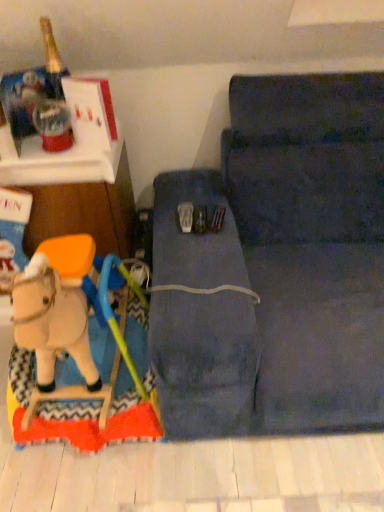
In order to face dark blue fabric studio couch at center, should I rotate leftwards or rightwards?

A 14.778 degree turn to the right will do.

At what (x,y) coordinates should I click in order to perform the action: click on dark blue fabric studio couch at center. Please return your answer as a coordinate pair (x, y). Looking at the image, I should click on (278, 267).

How many degrees apart are the facing directions of wooden rocking horse at left and wooden matte horse at lower left?

There is a 0.332-degree angle between the facing directions of wooden rocking horse at left and wooden matte horse at lower left.

Is wooden rocking horse at left further to the viewer compared to wooden matte horse at lower left?

Yes.

From the image's perspective, would you say wooden rocking horse at left is shown under wooden matte horse at lower left?

No, from the image's perspective, wooden rocking horse at left is not below wooden matte horse at lower left.

Would you say wooden rocking horse at left is outside wooden matte horse at lower left?

Yes, wooden rocking horse at left is not within wooden matte horse at lower left.

Considering the positions of objects wooden matte horse at lower left and dark blue fabric studio couch at center in the image provided, who is behind, wooden matte horse at lower left or dark blue fabric studio couch at center?

wooden matte horse at lower left.

Is wooden matte horse at lower left in contact with dark blue fabric studio couch at center?

No, wooden matte horse at lower left is not next to dark blue fabric studio couch at center.

Locate an element on the screen. This screenshot has height=512, width=384. furniture above the dark blue fabric studio couch at center (from the image's perspective) is located at coordinates (79, 199).

Is wooden rocking horse at left positioned with its back to dark blue fabric studio couch at center?

No, wooden rocking horse at left is not facing the opposite direction of dark blue fabric studio couch at center.

Is wooden rocking horse at left taller or shorter than dark blue fabric studio couch at center?

In the image, wooden rocking horse at left appears to be taller than dark blue fabric studio couch at center.

Is wooden rocking horse at left completely or partially outside of dark blue fabric studio couch at center?

Absolutely, wooden rocking horse at left is external to dark blue fabric studio couch at center.

Considering the relative sizes of wooden matte horse at lower left and wooden rocking horse at left in the image provided, is wooden matte horse at lower left bigger than wooden rocking horse at left?

No, wooden matte horse at lower left is not bigger than wooden rocking horse at left.

Would you say wooden matte horse at lower left is outside wooden rocking horse at left?

wooden matte horse at lower left lies outside wooden rocking horse at left's area.

Which object is further away from the camera, wooden matte horse at lower left or wooden rocking horse at left?

wooden rocking horse at left is further away from the camera.

Image resolution: width=384 pixels, height=512 pixels. What are the coordinates of `furniture located above the dark blue fabric studio couch at center (from the image's perspective)` in the screenshot? It's located at (79, 199).

Which is more to the right, dark blue fabric studio couch at center or wooden rocking horse at left?

dark blue fabric studio couch at center.

Is the position of dark blue fabric studio couch at center less distant than that of wooden rocking horse at left?

Yes, dark blue fabric studio couch at center is closer to the viewer.

Is dark blue fabric studio couch at center not near wooden rocking horse at left?

dark blue fabric studio couch at center is actually quite close to wooden rocking horse at left.

Considering the relative sizes of dark blue fabric studio couch at center and wooden matte horse at lower left in the image provided, is dark blue fabric studio couch at center wider than wooden matte horse at lower left?

Correct, the width of dark blue fabric studio couch at center exceeds that of wooden matte horse at lower left.

In terms of size, does dark blue fabric studio couch at center appear bigger or smaller than wooden matte horse at lower left?

In the image, dark blue fabric studio couch at center appears to be larger than wooden matte horse at lower left.

Image resolution: width=384 pixels, height=512 pixels. In order to click on studio couch on the right of the wooden matte horse at lower left in this screenshot , I will do click(x=278, y=267).

Locate an element on the screen. toy below the wooden rocking horse at left (from a real-world perspective) is located at coordinates (72, 350).

What are the coordinates of `toy on the left of dark blue fabric studio couch at center` in the screenshot? It's located at (72, 350).

Considering their positions, is wooden matte horse at lower left positioned further to wooden rocking horse at left than dark blue fabric studio couch at center?

dark blue fabric studio couch at center.

Estimate the real-world distances between objects in this image. Which object is closer to wooden matte horse at lower left, dark blue fabric studio couch at center or wooden rocking horse at left?

wooden rocking horse at left.

From the image, which object appears to be nearer to dark blue fabric studio couch at center, wooden rocking horse at left or wooden matte horse at lower left?

wooden matte horse at lower left is closer to dark blue fabric studio couch at center.

Considering their positions, is wooden rocking horse at left positioned further to wooden matte horse at lower left than dark blue fabric studio couch at center?

dark blue fabric studio couch at center is further to wooden matte horse at lower left.

In the scene shown: From the image, which object appears to be farther from wooden rocking horse at left, dark blue fabric studio couch at center or wooden matte horse at lower left?

The object further to wooden rocking horse at left is dark blue fabric studio couch at center.

From the image, which object appears to be farther from dark blue fabric studio couch at center, wooden matte horse at lower left or wooden rocking horse at left?

wooden rocking horse at left lies further to dark blue fabric studio couch at center than the other object.

The image size is (384, 512). Find the location of `toy located between wooden rocking horse at left and dark blue fabric studio couch at center in the left-right direction`. toy located between wooden rocking horse at left and dark blue fabric studio couch at center in the left-right direction is located at coordinates pyautogui.click(x=72, y=350).